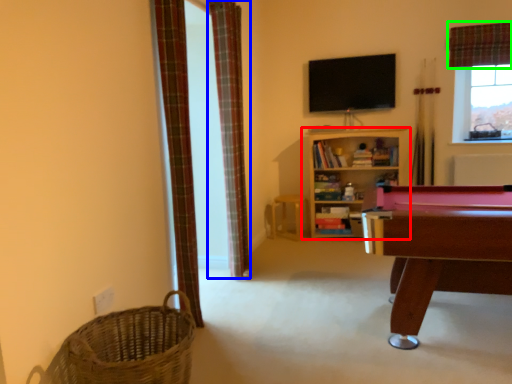
Question: Which is farther away from shelf (highlighted by a red box)? curtain (highlighted by a blue box) or curtain (highlighted by a green box)?

Choices:
 (A) curtain
 (B) curtain

Answer: (A)